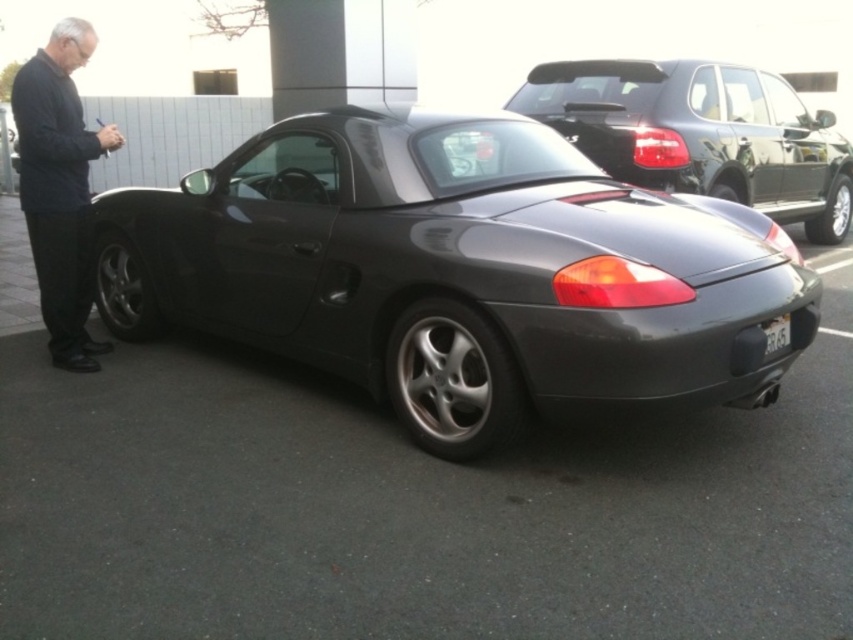
Question: Which point is farther to the camera?

Choices:
 (A) (236, 314)
 (B) (74, 163)
 (C) (543, 102)
 (D) (775, 330)

Answer: (C)

Question: Can you confirm if dark gray sweater at left is thinner than white plastic license plate at rear?

Choices:
 (A) yes
 (B) no

Answer: (B)

Question: Does satin black sports car at center appear over glossy black car at center?

Choices:
 (A) yes
 (B) no

Answer: (B)

Question: Can you confirm if glossy black car at center is positioned to the right of white plastic license plate at rear?

Choices:
 (A) yes
 (B) no

Answer: (A)

Question: Which point appears closest to the camera in this image?

Choices:
 (A) (500, 358)
 (B) (627, 129)
 (C) (788, 321)

Answer: (A)

Question: Which point is farther to the camera?

Choices:
 (A) satin black sports car at center
 (B) white plastic license plate at rear
 (C) dark gray sweater at left

Answer: (C)